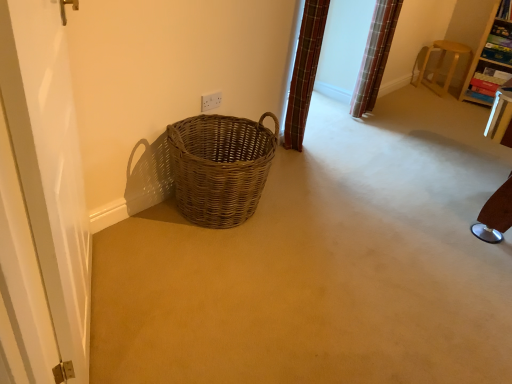
Question: From the image's perspective, is light brown wooden stool at upper right, which is the 1th furniture in left-to-right order, positioned above or below wooden bookshelf at upper right, acting as the 1th furniture starting from the right?

Choices:
 (A) above
 (B) below

Answer: (B)

Question: In terms of size, does light brown wooden stool at upper right, which is the 1th furniture in left-to-right order, appear bigger or smaller than wooden bookshelf at upper right, acting as the 1th furniture starting from the right?

Choices:
 (A) big
 (B) small

Answer: (B)

Question: Which is nearer to the plaid fabric curtain at upper right, the second curtain in the front-to-back sequence?

Choices:
 (A) wooden bookshelf at upper right, acting as the 1th furniture starting from the right
 (B) light brown wooden stool at upper right, which is the 1th furniture in left-to-right order
 (C) woven brown basket at center
 (D) white glossy screen door at left
 (E) wooden bookshelf at upper right

Answer: (B)

Question: Estimate the real-world distances between objects in this image. Which object is closer to the wooden bookshelf at upper right?

Choices:
 (A) white glossy screen door at left
 (B) woven brown basket at center
 (C) plaid fabric curtain at upper right, which is the first curtain from left to right
 (D) plaid fabric curtain at upper right, which ranks as the first curtain in back-to-front order
 (E) wooden bookshelf at upper right, acting as the 1th furniture starting from the right

Answer: (E)